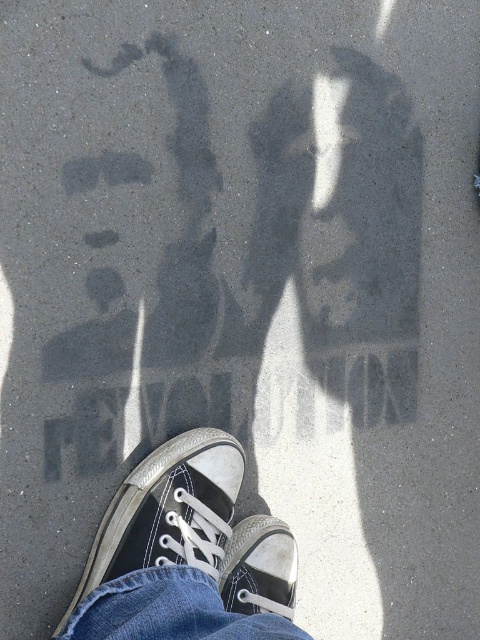
Question: Which point is closer to the camera taking this photo?

Choices:
 (A) (273, 531)
 (B) (142, 525)

Answer: (B)

Question: Which of the following is the closest to the observer?

Choices:
 (A) black canvas shoe at lower center
 (B) black canvas shoe at center

Answer: (A)

Question: Where is black canvas shoe at lower center located in relation to black canvas shoe at center in the image?

Choices:
 (A) above
 (B) below

Answer: (A)

Question: Among these points, which one is nearest to the camera?

Choices:
 (A) (213, 518)
 (B) (292, 572)

Answer: (A)

Question: Does black canvas shoe at lower center have a smaller size compared to black canvas shoe at center?

Choices:
 (A) no
 (B) yes

Answer: (A)

Question: Where is black canvas shoe at lower center located in relation to black canvas shoe at center in the image?

Choices:
 (A) above
 (B) below

Answer: (A)